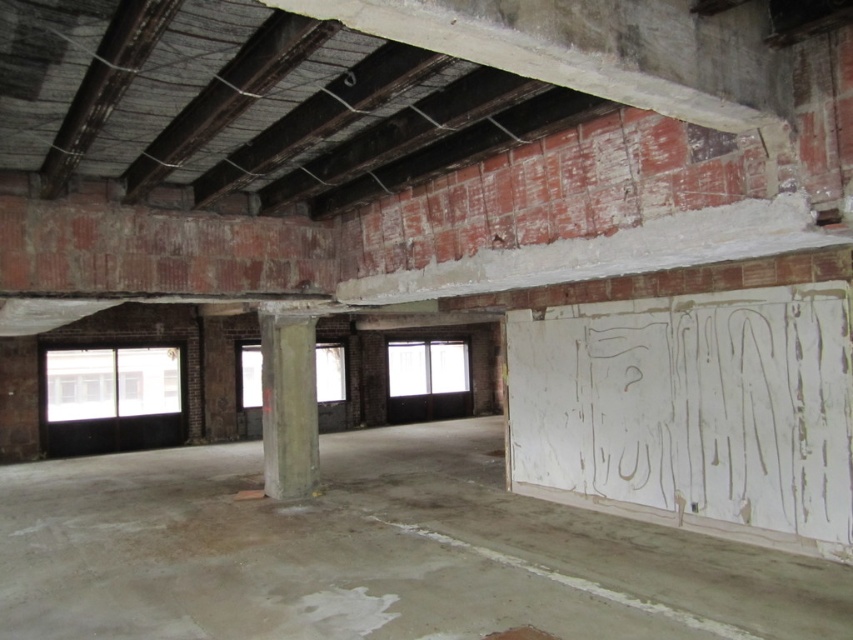
Question: Which point is closer to the camera?

Choices:
 (A) (595, 568)
 (B) (299, 440)

Answer: (A)

Question: Is concrete floor at center smaller than concrete pillar at center?

Choices:
 (A) yes
 (B) no

Answer: (B)

Question: Which of the following is the farthest from the observer?

Choices:
 (A) (285, 353)
 (B) (730, 625)

Answer: (A)

Question: Can you confirm if concrete floor at center is smaller than concrete pillar at center?

Choices:
 (A) yes
 (B) no

Answer: (B)

Question: Is concrete floor at center to the right of concrete pillar at center from the viewer's perspective?

Choices:
 (A) no
 (B) yes

Answer: (B)